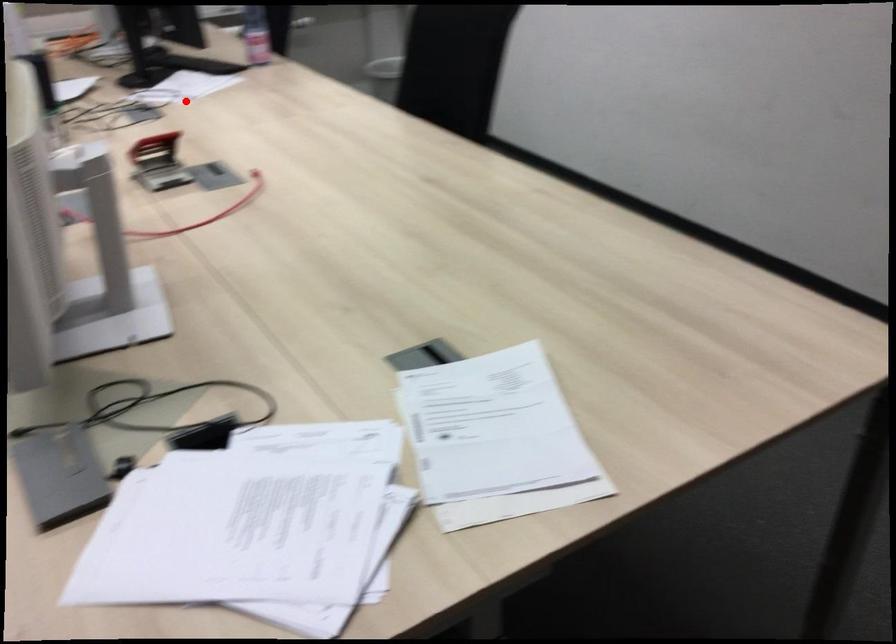
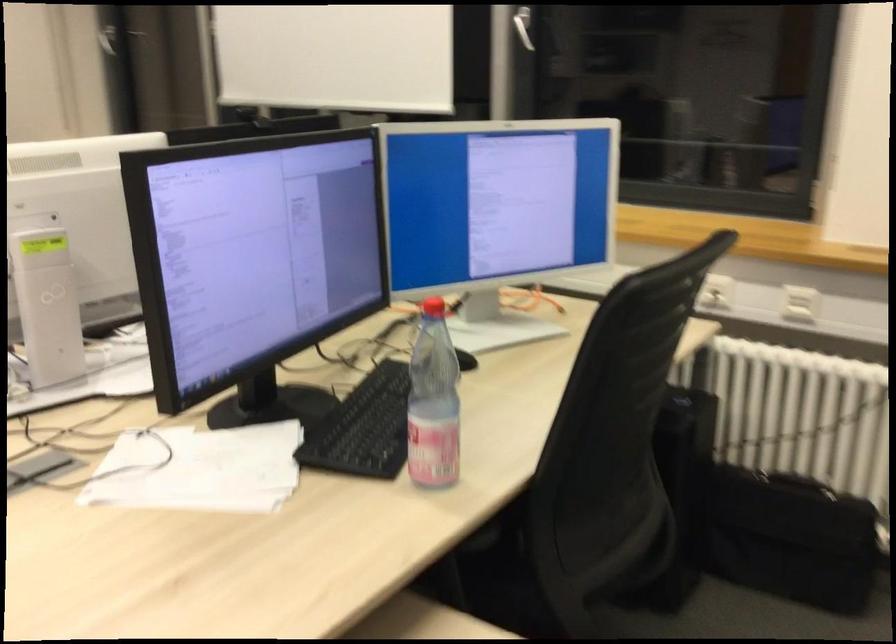
Locate, in the second image, the point that corresponds to the highlighted location in the first image.

(199, 469)